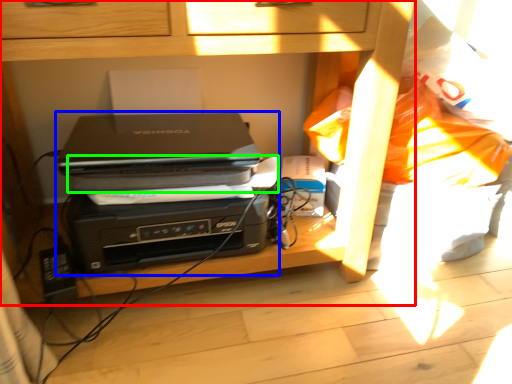
Question: Based on their relative distances, which object is nearer to furniture (highlighted by a red box)? Choose from printer (highlighted by a blue box) and paperback book (highlighted by a green box).

Choices:
 (A) printer
 (B) paperback book

Answer: (A)